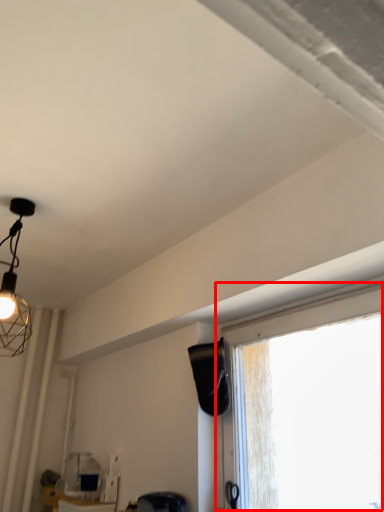
Question: From the image, what is the correct spatial relationship of window (annotated by the red box) in relation to swivel chair?

Choices:
 (A) right
 (B) left

Answer: (A)